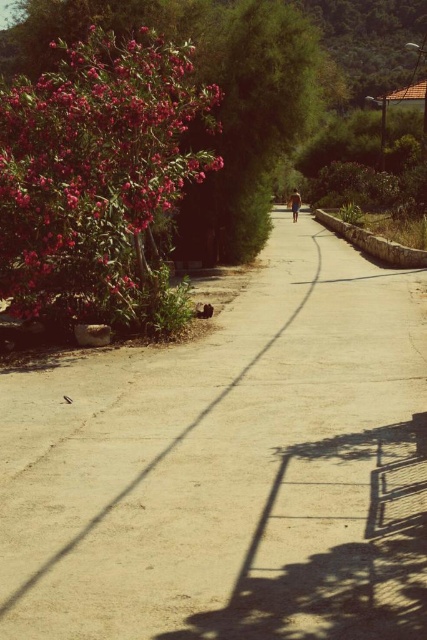
Question: Is dirt track at center smaller than blue denim shorts at center?

Choices:
 (A) no
 (B) yes

Answer: (A)

Question: Among these points, which one is nearest to the camera?

Choices:
 (A) (163, 92)
 (B) (292, 212)
 (C) (231, 570)

Answer: (C)

Question: Is matte pink flowers at left positioned in front of blue denim shorts at center?

Choices:
 (A) yes
 (B) no

Answer: (A)

Question: Can you confirm if matte pink flowers at left is smaller than blue denim shorts at center?

Choices:
 (A) yes
 (B) no

Answer: (A)

Question: Among these points, which one is farthest from the camera?

Choices:
 (A) (424, 426)
 (B) (294, 202)
 (C) (35, 184)

Answer: (B)

Question: Which of the following is the farthest from the observer?

Choices:
 (A) (x=131, y=596)
 (B) (x=300, y=204)

Answer: (B)